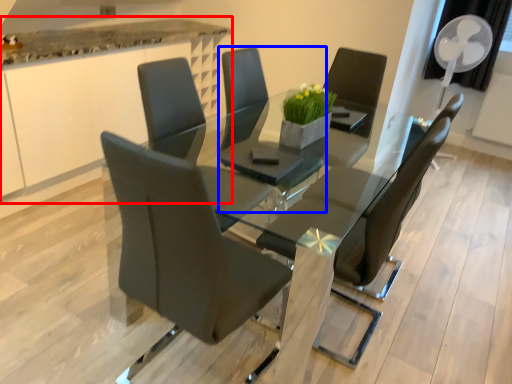
Question: Which point is closer to the camera, counter (highlighted by a red box) or chair (highlighted by a blue box)?

Choices:
 (A) counter
 (B) chair

Answer: (B)